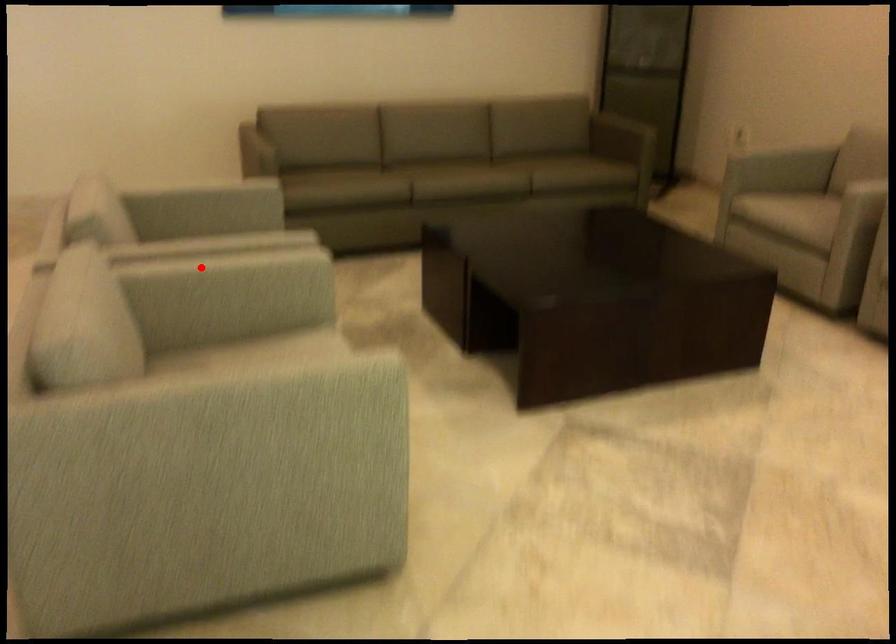
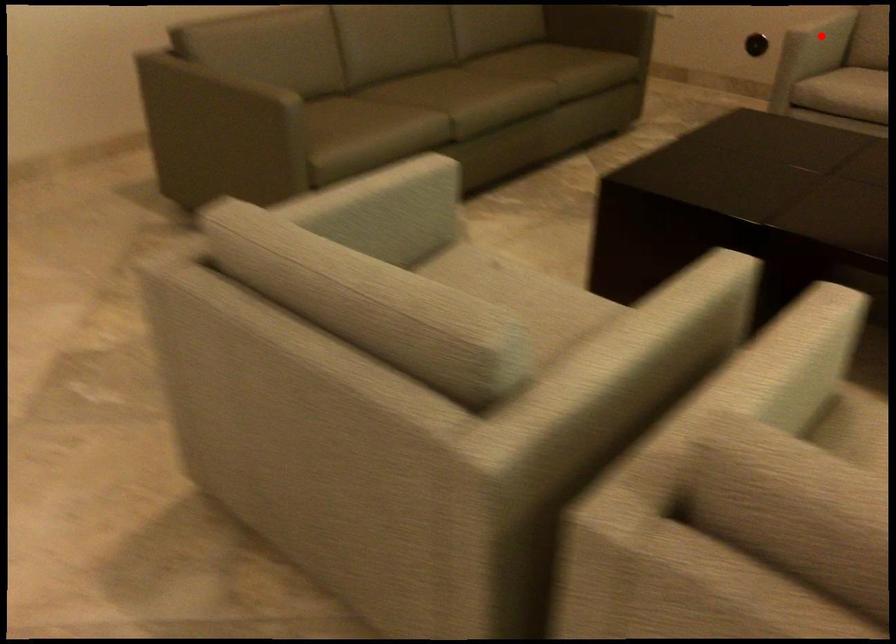
Looking at this image, I am providing you with two images of the same scene from different viewpoints. A red point is marked on the first image and another point is marked on the second image. Is the red point in image1 aligned with the point shown in image2?

No